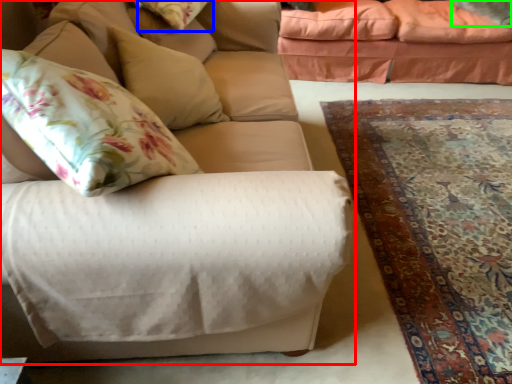
Question: Which object is positioned closest to studio couch (highlighted by a red box)? Select from pillow (highlighted by a blue box) and pillow (highlighted by a green box).

Choices:
 (A) pillow
 (B) pillow

Answer: (A)